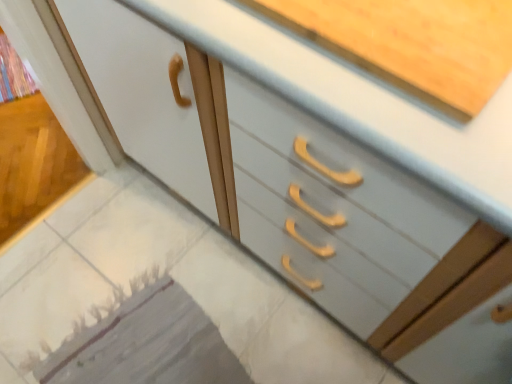
Describe the element at coordinates (51, 306) in the screenshot. I see `white glossy tile at lower left` at that location.

What is the approximate height of white glossy tile at lower left?

white glossy tile at lower left is 0.95 inches tall.

Where is `white glossy tile at lower left`? The image size is (512, 384). white glossy tile at lower left is located at coordinates (51, 306).

What do you see at coordinates (359, 102) in the screenshot? I see `white glossy countertop at upper center` at bounding box center [359, 102].

Image resolution: width=512 pixels, height=384 pixels. What are the coordinates of `white glossy countertop at upper center` in the screenshot? It's located at (x=359, y=102).

You are a GUI agent. You are given a task and a screenshot of the screen. Output one action in this format:
    pyautogui.click(x=<x>, y=<y>)
    Task: Click on the white glossy tile at lower left
    
    Given the screenshot: What is the action you would take?
    pyautogui.click(x=51, y=306)

Which object is positioned more to the right, white glossy countertop at upper center or white glossy tile at lower left?

white glossy countertop at upper center is more to the right.

Which object is closer to the camera, white glossy countertop at upper center or white glossy tile at lower left?

white glossy countertop at upper center is closer to the camera.

Is point (193, 14) more distant than point (57, 332)?

No, it is not.

From the image's perspective, is white glossy countertop at upper center on white glossy tile at lower left?

Correct, white glossy countertop at upper center appears higher than white glossy tile at lower left in the image.

From a real-world perspective, is white glossy countertop at upper center positioned over white glossy tile at lower left based on gravity?

Yes, from a real-world perspective, white glossy countertop at upper center is over white glossy tile at lower left

Which object is thinner, white glossy countertop at upper center or white glossy tile at lower left?

white glossy tile at lower left is thinner.

Considering the sizes of objects white glossy countertop at upper center and white glossy tile at lower left in the image provided, who is shorter, white glossy countertop at upper center or white glossy tile at lower left?

With less height is white glossy tile at lower left.

Looking at the image, does white glossy countertop at upper center seem bigger or smaller compared to white glossy tile at lower left?

Considering their sizes, white glossy countertop at upper center takes up more space than white glossy tile at lower left.

Which is correct: white glossy countertop at upper center is inside white glossy tile at lower left, or outside of it?

white glossy countertop at upper center lies outside white glossy tile at lower left.

Is white glossy countertop at upper center not close to white glossy tile at lower left?

That's not correct — white glossy countertop at upper center is a little close to white glossy tile at lower left.

In the scene shown: Is white glossy countertop at upper center looking in the opposite direction of white glossy tile at lower left?

That's not correct — white glossy countertop at upper center is not looking away from white glossy tile at lower left.

How many degrees apart are the facing directions of white glossy countertop at upper center and white glossy tile at lower left?

The angle between the facing direction of white glossy countertop at upper center and the facing direction of white glossy tile at lower left is 102 degrees.

Identify the location of counter top in front of the white glossy tile at lower left. (359, 102).

Between white glossy tile at lower left and white glossy countertop at upper center, which one appears on the left side from the viewer's perspective?

Positioned to the left is white glossy tile at lower left.

Which object is further away from the camera taking this photo, white glossy tile at lower left or white glossy countertop at upper center?

Positioned behind is white glossy tile at lower left.

From the picture: Which is less distant, [78,331] or [318,73]?

The point [318,73] is closer to the camera.

From the image's perspective, is white glossy tile at lower left on white glossy countertop at upper center?

Incorrect, from the image's perspective, white glossy tile at lower left is lower than white glossy countertop at upper center.

From a real-world perspective, is white glossy tile at lower left located higher than white glossy countertop at upper center?

Actually, white glossy tile at lower left is physically below white glossy countertop at upper center in the real world.

Which object is wider, white glossy tile at lower left or white glossy countertop at upper center?

white glossy countertop at upper center is wider.

Can you confirm if white glossy tile at lower left is shorter than white glossy countertop at upper center?

Correct, white glossy tile at lower left is not as tall as white glossy countertop at upper center.

Is white glossy tile at lower left bigger than white glossy countertop at upper center?

No, white glossy tile at lower left is not bigger than white glossy countertop at upper center.

Is white glossy tile at lower left not inside white glossy countertop at upper center?

Absolutely, white glossy tile at lower left is external to white glossy countertop at upper center.

Consider the image. Is white glossy tile at lower left far from white glossy countertop at upper center?

No.

Could you tell me if white glossy tile at lower left is turned towards white glossy countertop at upper center?

No, white glossy tile at lower left is not aimed at white glossy countertop at upper center.

Consider the image. Can you tell me how much white glossy tile at lower left and white glossy countertop at upper center differ in facing direction?

102 degrees.

The height and width of the screenshot is (384, 512). I want to click on tile located behind the white glossy countertop at upper center, so click(51, 306).

Identify the location of counter top above the white glossy tile at lower left (from the image's perspective). This screenshot has height=384, width=512. (359, 102).

Find the location of a particular element. The width and height of the screenshot is (512, 384). counter top that appears in front of the white glossy tile at lower left is located at coordinates (359, 102).